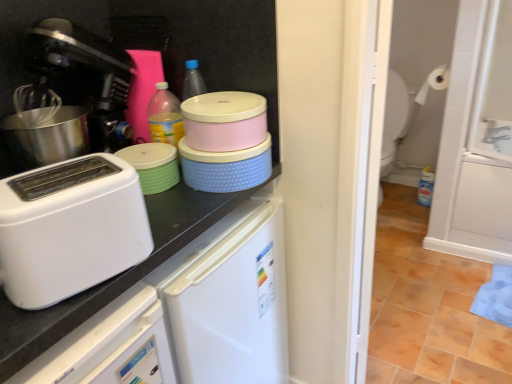
Question: Is white glossy screen door at right outside of white matte toilet paper at upper right?

Choices:
 (A) yes
 (B) no

Answer: (A)

Question: Considering the relative sizes of white glossy screen door at right and white matte toilet paper at upper right in the image provided, is white glossy screen door at right smaller than white matte toilet paper at upper right?

Choices:
 (A) yes
 (B) no

Answer: (B)

Question: Does white glossy screen door at right have a greater height compared to white matte toilet paper at upper right?

Choices:
 (A) no
 (B) yes

Answer: (B)

Question: Is white glossy screen door at right surrounding white matte toilet paper at upper right?

Choices:
 (A) yes
 (B) no

Answer: (B)

Question: Considering the relative sizes of white glossy screen door at right and white matte toilet paper at upper right in the image provided, is white glossy screen door at right shorter than white matte toilet paper at upper right?

Choices:
 (A) yes
 (B) no

Answer: (B)

Question: Is white glossy screen door at right bigger or smaller than white matte countertop at upper left?

Choices:
 (A) small
 (B) big

Answer: (A)

Question: Considering the relative positions of white glossy screen door at right and white matte countertop at upper left in the image provided, is white glossy screen door at right to the left or to the right of white matte countertop at upper left?

Choices:
 (A) left
 (B) right

Answer: (B)

Question: In terms of height, does white glossy screen door at right look taller or shorter compared to white matte countertop at upper left?

Choices:
 (A) tall
 (B) short

Answer: (A)

Question: From a real-world perspective, is white glossy screen door at right above or below white matte countertop at upper left?

Choices:
 (A) above
 (B) below

Answer: (A)

Question: From a real-world perspective, is white glossy screen door at right above or below green matte container at center?

Choices:
 (A) above
 (B) below

Answer: (B)

Question: Is point (453, 210) positioned closer to the camera than point (174, 168)?

Choices:
 (A) closer
 (B) farther

Answer: (B)

Question: Looking at the image, does white glossy screen door at right seem bigger or smaller compared to green matte container at center?

Choices:
 (A) big
 (B) small

Answer: (A)

Question: Based on their positions, is white glossy screen door at right located to the left or right of green matte container at center?

Choices:
 (A) left
 (B) right

Answer: (B)

Question: Relative to white matte toilet paper at upper right, is black plastic coffee machine at left in front or behind?

Choices:
 (A) behind
 (B) front

Answer: (B)

Question: From their relative heights in the image, would you say black plastic coffee machine at left is taller or shorter than white matte toilet paper at upper right?

Choices:
 (A) tall
 (B) short

Answer: (A)